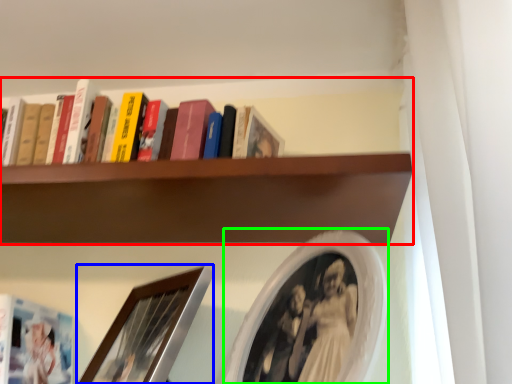
Question: Estimate the real-world distances between objects in this image. Which object is farther from shelf (highlighted by a red box), picture frame (highlighted by a blue box) or picture frame (highlighted by a green box)?

Choices:
 (A) picture frame
 (B) picture frame

Answer: (A)